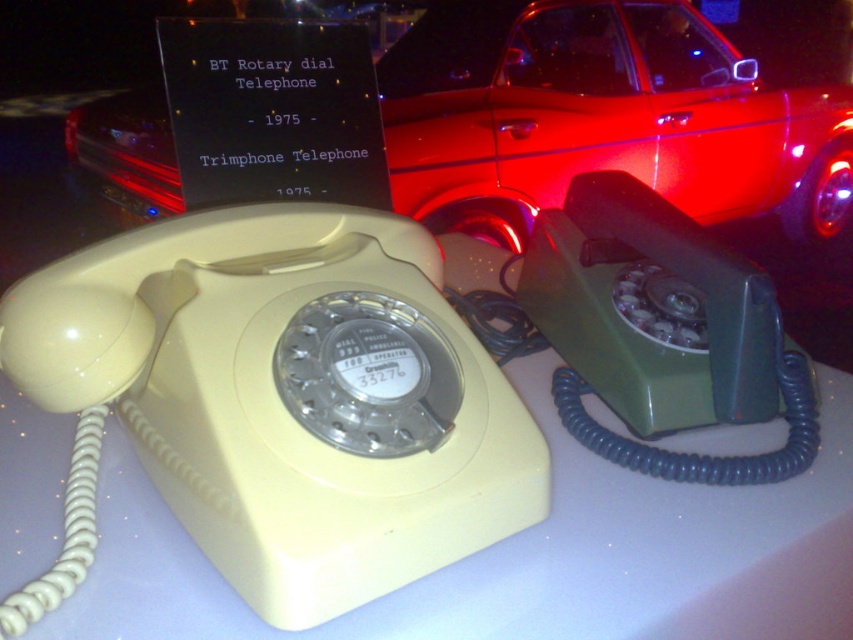
You are standing in front of the two vintage rotary dial telephones displayed on a white surface. You notice a point marked at coordinates (349,449). Which object is located at this point?

The point at coordinates (349,449) corresponds to the white plastic table at center where the two vintage rotary dial telephones are placed.

You are standing in front of the two vintage rotary dial telephones displayed on the white surface. There is a point marked at coordinates (349, 449). Which object is this point located on?

The point at (349, 449) is located on the white plastic table at center.

From the picture: You have two vintage rotary dial telephones placed side by side on a white plastic table at center. If you want to place a ruler between them to measure the distance, will the ruler of 12 inches be sufficient to measure the space between them?

The distance between the two vintage rotary dial telephones is 13.60 inches. Since the ruler is only 12 inches long, it cannot fully measure the space between them.